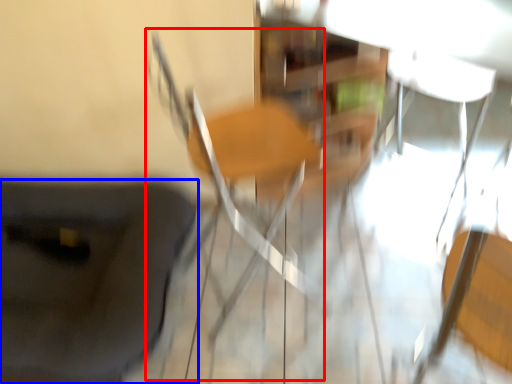
Question: Which object is closer to the camera taking this photo, chair (highlighted by a red box) or furniture (highlighted by a blue box)?

Choices:
 (A) chair
 (B) furniture

Answer: (A)